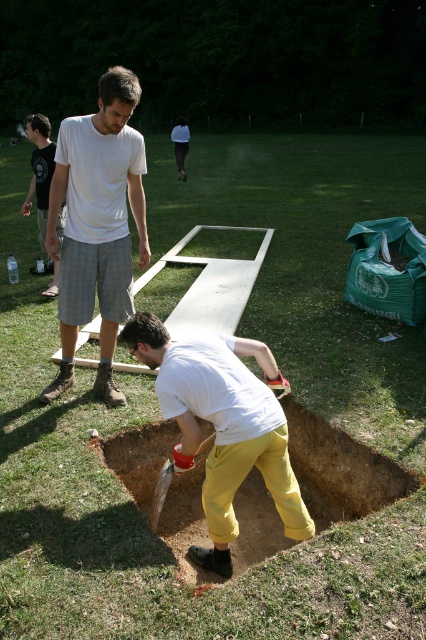
Question: Does yellow cotton pants at lower center appear on the right side of brown dirt hole at center?

Choices:
 (A) no
 (B) yes

Answer: (A)

Question: Among these objects, which one is farthest from the camera?

Choices:
 (A) yellow cotton pants at lower center
 (B) wooden shovel at lower center
 (C) brown dirt hole at center
 (D) white cotton shirt at upper left

Answer: (D)

Question: Can you confirm if yellow cotton pants at lower center is positioned below brown dirt hole at center?

Choices:
 (A) no
 (B) yes

Answer: (A)

Question: Which is nearer to the white cotton shirt at upper left?

Choices:
 (A) yellow cotton pants at lower center
 (B) white t-shirt at upper left
 (C) wooden shovel at lower center

Answer: (A)

Question: In this image, where is white cotton shirt at upper left located relative to white t-shirt at upper left?

Choices:
 (A) below
 (B) above

Answer: (A)

Question: Estimate the real-world distances between objects in this image. Which object is farther from the brown dirt hole at center?

Choices:
 (A) white t-shirt at upper left
 (B) yellow cotton pants at lower center
 (C) wooden shovel at lower center

Answer: (A)